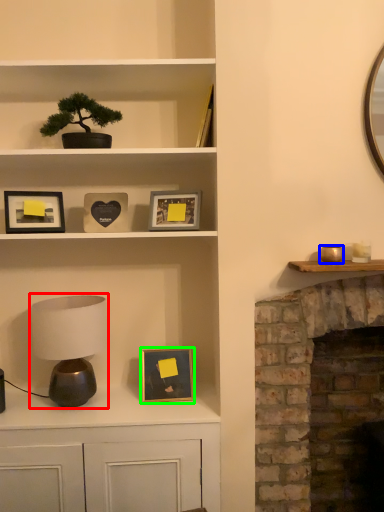
Question: Considering the real-world distances, which object is closest to table lamp (highlighted by a red box)? candle holder (highlighted by a blue box) or picture frame (highlighted by a green box).

Choices:
 (A) candle holder
 (B) picture frame

Answer: (B)